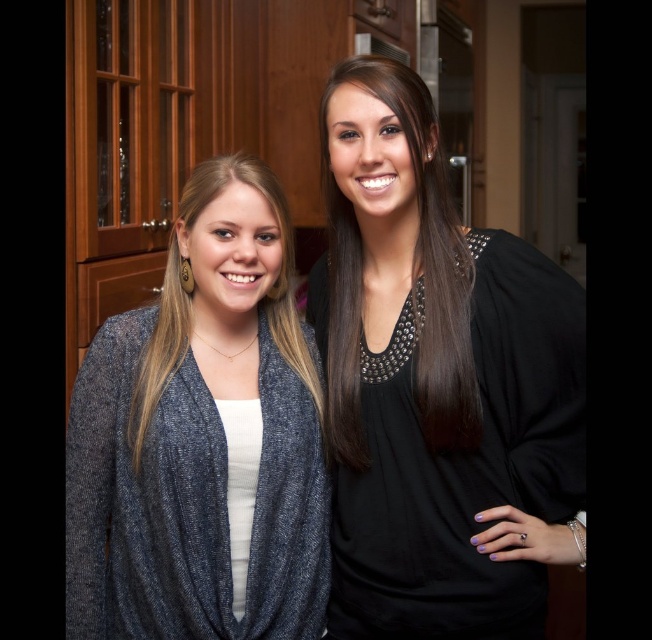
Which is below, black matte blouse at center or black studded top at center?

black matte blouse at center is lower down.

Can you confirm if black matte blouse at center is wider than black studded top at center?

Yes.

What do you see at coordinates (436, 385) in the screenshot? I see `black matte blouse at center` at bounding box center [436, 385].

Find the location of a particular element. This screenshot has height=640, width=652. black matte blouse at center is located at coordinates (436, 385).

Who is more forward, [213,593] or [449,264]?

Point [213,593] is more forward.

Is knit cardigan at left further to the viewer compared to black studded top at center?

That is False.

Between point (231, 445) and point (422, 188), which one is positioned behind?

Positioned behind is point (422, 188).

I want to click on knit cardigan at left, so click(x=201, y=440).

Does black matte blouse at center have a larger size compared to knit cardigan at left?

Yes.

Describe the element at coordinates (436, 385) in the screenshot. Image resolution: width=652 pixels, height=640 pixels. I see `black matte blouse at center` at that location.

Image resolution: width=652 pixels, height=640 pixels. I want to click on black matte blouse at center, so pos(436,385).